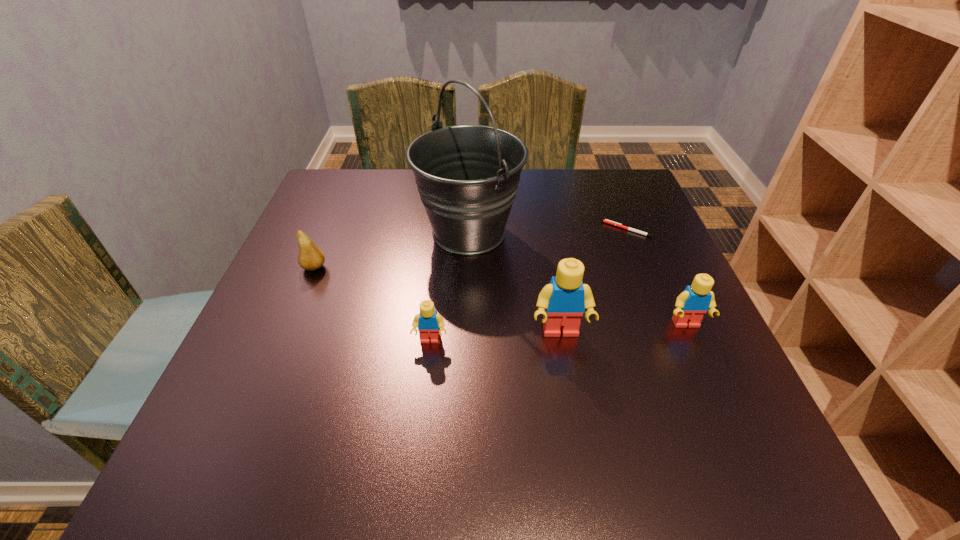
Please point out where to position a new Lego on the left to maintain spacing. Please provide its 2D coordinates. Your answer should be formatted as a tuple, i.e. [(x, y)], where the tuple contains the x and y coordinates of a point satisfying the conditions above.

[(296, 349)]